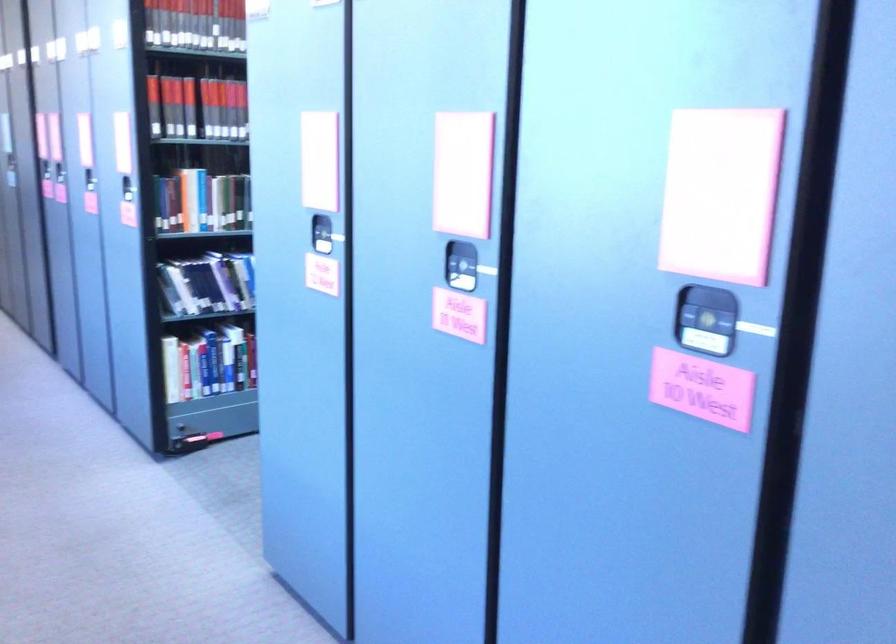
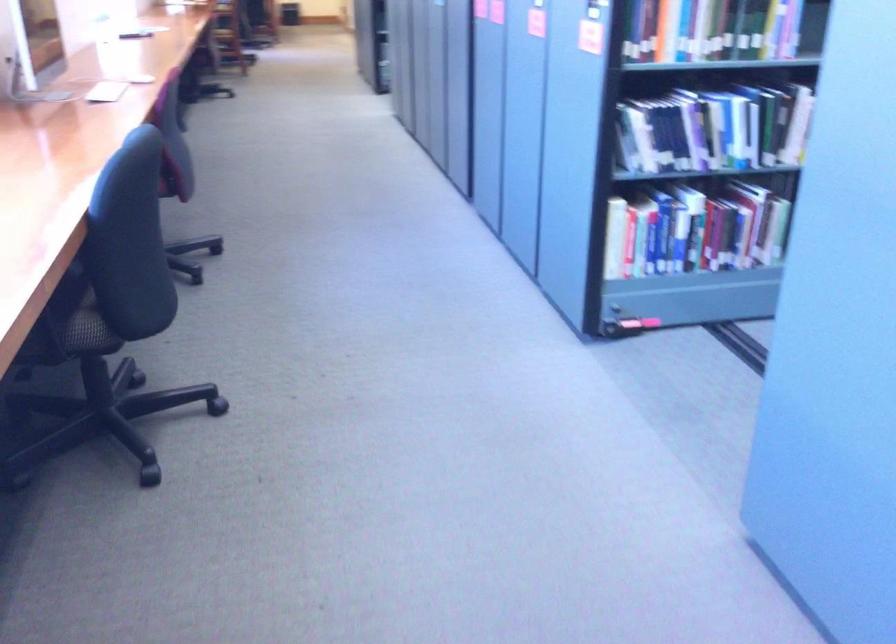
Question: The camera is either moving clockwise (left) or counter-clockwise (right) around the object. The first image is from the beginning of the video and the second image is from the end. Is the camera moving left or right when shooting the video?

Choices:
 (A) Left
 (B) Right

Answer: (B)